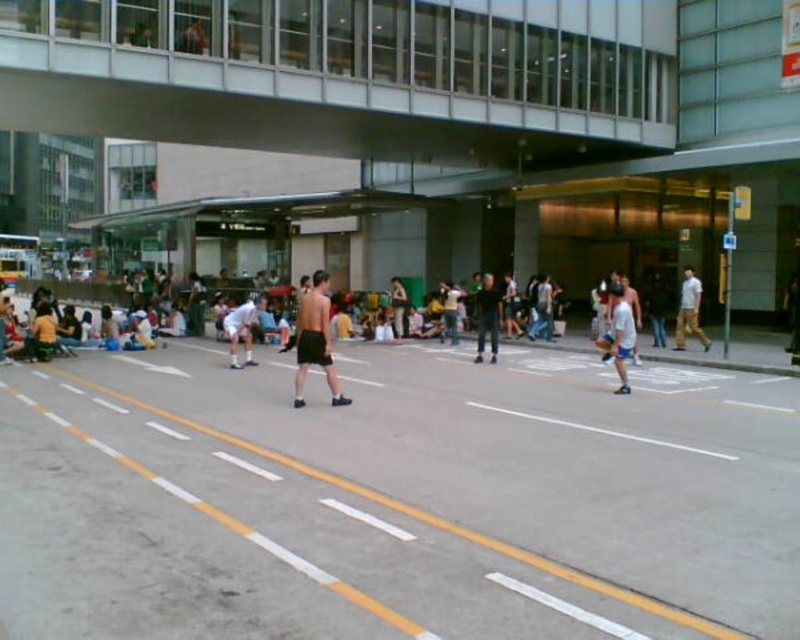
Question: Where is black matte shorts at center located in relation to dark blue jeans at center in the image?

Choices:
 (A) left
 (B) right

Answer: (A)

Question: Observing the image, what is the correct spatial positioning of black matte shorts at center in reference to white cotton shirt at center?

Choices:
 (A) below
 (B) above

Answer: (B)

Question: Is dark blue jeans at center closer to camera compared to white cotton shirt at center?

Choices:
 (A) no
 (B) yes

Answer: (B)

Question: Based on their relative distances, which object is nearer to the black matte shorts at center?

Choices:
 (A) dark blue jeans at center
 (B) white cotton shirt at center

Answer: (A)

Question: Among these points, which one is farthest from the camera?

Choices:
 (A) (498, 285)
 (B) (316, 349)

Answer: (A)

Question: Estimate the real-world distances between objects in this image. Which object is closer to the black matte shorts at center?

Choices:
 (A) white cotton shirt at center
 (B) dark blue jeans at center

Answer: (B)